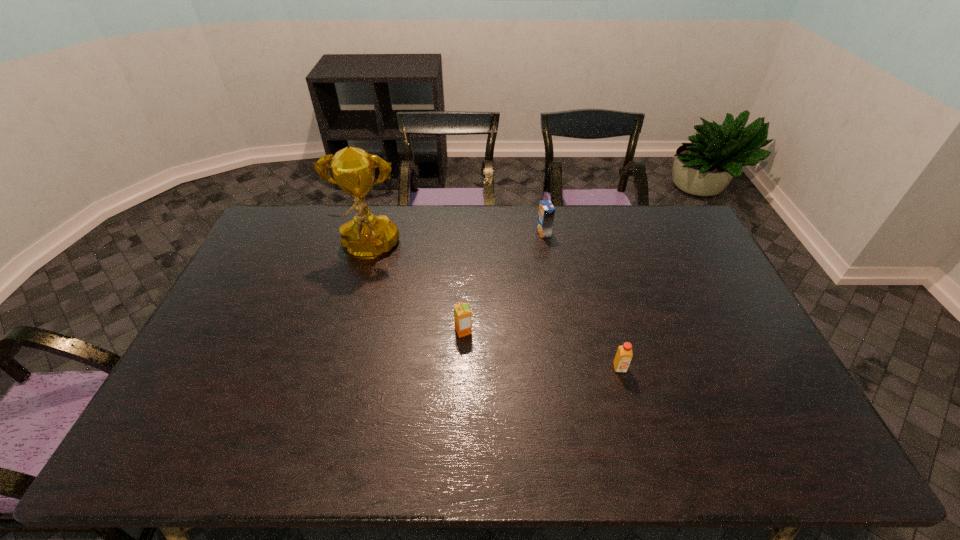
At what (x,y) coordinates should I click in order to perform the action: click on free space located 0.110m on the front of the leftmost orange juice. Please return your answer as a coordinate pair (x, y). The height and width of the screenshot is (540, 960). Looking at the image, I should click on (462, 369).

The height and width of the screenshot is (540, 960). Identify the location of free region located on the front and back of the rightmost orange juice. (631, 410).

Where is `award situated at the far edge`? award situated at the far edge is located at coordinates (366, 236).

Locate an element on the screen. The width and height of the screenshot is (960, 540). orange_juice at the far edge is located at coordinates (546, 213).

In the image, there is a desktop. What are the coordinates of `vacant space at the far edge` in the screenshot? It's located at (438, 230).

Identify the location of free space at the left edge of the desktop. The width and height of the screenshot is (960, 540). (246, 370).

In the image, there is a desktop. At what (x,y) coordinates should I click in order to perform the action: click on vacant space at the right edge. Please return your answer as a coordinate pair (x, y). Looking at the image, I should click on (732, 300).

The height and width of the screenshot is (540, 960). I want to click on free space at the far left corner of the desktop, so click(295, 228).

Find the location of a particular element. The image size is (960, 540). vacant space at the near left corner is located at coordinates (199, 459).

Where is `vacant point at the far right corner`? The width and height of the screenshot is (960, 540). vacant point at the far right corner is located at coordinates (644, 205).